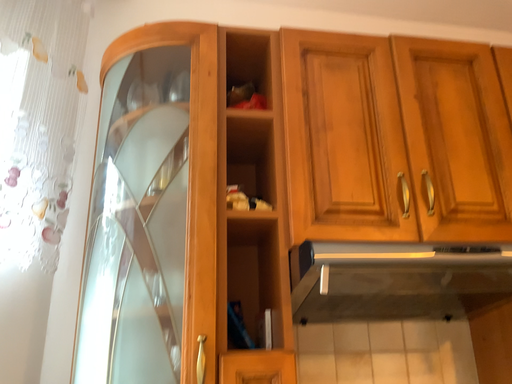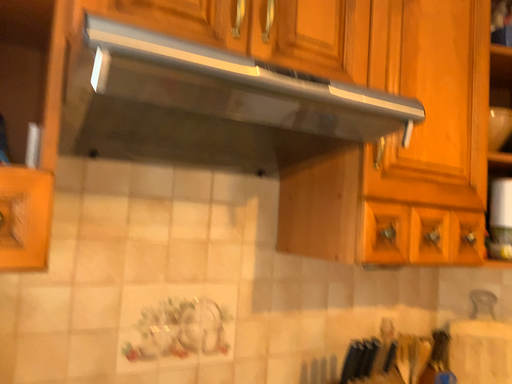
Question: Which way did the camera rotate in the video?

Choices:
 (A) rotated upward
 (B) rotated downward

Answer: (B)